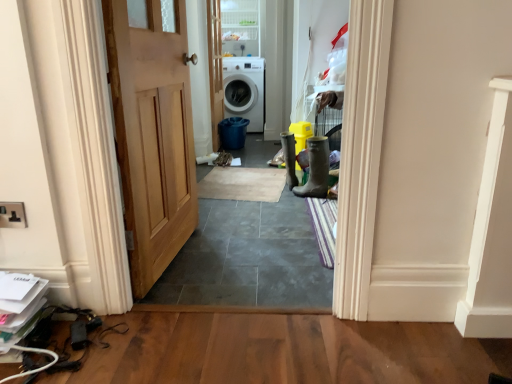
Where is `free region under natural wood door at center, positioned as the second door in back-to-front order (from a real-world perspective)`? This screenshot has height=384, width=512. free region under natural wood door at center, positioned as the second door in back-to-front order (from a real-world perspective) is located at coordinates (173, 263).